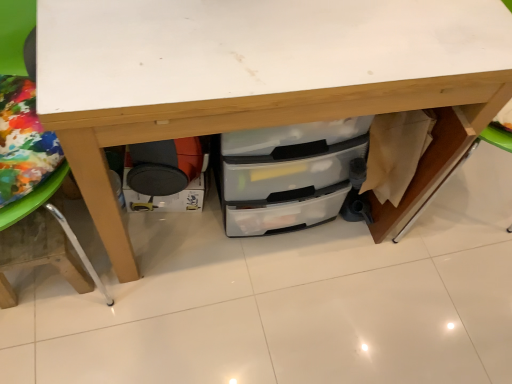
Question: Does wooden table leg at lower left appear on the left side of transparent plastic drawers at center?

Choices:
 (A) no
 (B) yes

Answer: (B)

Question: Is wooden table leg at lower left smaller than transparent plastic drawers at center?

Choices:
 (A) yes
 (B) no

Answer: (A)

Question: Is wooden table leg at lower left to the right of transparent plastic drawers at center from the viewer's perspective?

Choices:
 (A) yes
 (B) no

Answer: (B)

Question: Is wooden table leg at lower left positioned beyond the bounds of transparent plastic drawers at center?

Choices:
 (A) no
 (B) yes

Answer: (B)

Question: Is wooden table leg at lower left taller than transparent plastic drawers at center?

Choices:
 (A) yes
 (B) no

Answer: (A)

Question: In terms of width, does matte black drawer at lower left look wider or thinner when compared to transparent plastic drawers at center?

Choices:
 (A) wide
 (B) thin

Answer: (B)

Question: Do you think matte black drawer at lower left is within transparent plastic drawers at center, or outside of it?

Choices:
 (A) inside
 (B) outside

Answer: (A)

Question: In terms of height, does matte black drawer at lower left look taller or shorter compared to transparent plastic drawers at center?

Choices:
 (A) tall
 (B) short

Answer: (B)

Question: Is point click(200, 190) closer or farther from the camera than point click(493, 74)?

Choices:
 (A) farther
 (B) closer

Answer: (A)

Question: Looking at their shapes, would you say transparent plastic drawers at center is wider or thinner than wooden table leg at lower left?

Choices:
 (A) wide
 (B) thin

Answer: (B)

Question: Is transparent plastic drawers at center in front of or behind wooden table leg at lower left in the image?

Choices:
 (A) front
 (B) behind

Answer: (B)

Question: From a real-world perspective, is transparent plastic drawers at center physically located above or below wooden table leg at lower left?

Choices:
 (A) above
 (B) below

Answer: (B)

Question: Considering the relative positions of transparent plastic drawers at center and wooden table leg at lower left in the image provided, is transparent plastic drawers at center to the left or to the right of wooden table leg at lower left?

Choices:
 (A) left
 (B) right

Answer: (B)

Question: Which is correct: wooden table leg at lower left is inside matte black drawer at lower left, or outside of it?

Choices:
 (A) outside
 (B) inside

Answer: (A)

Question: Considering the relative positions of wooden table leg at lower left and matte black drawer at lower left in the image provided, is wooden table leg at lower left to the left or to the right of matte black drawer at lower left?

Choices:
 (A) left
 (B) right

Answer: (A)